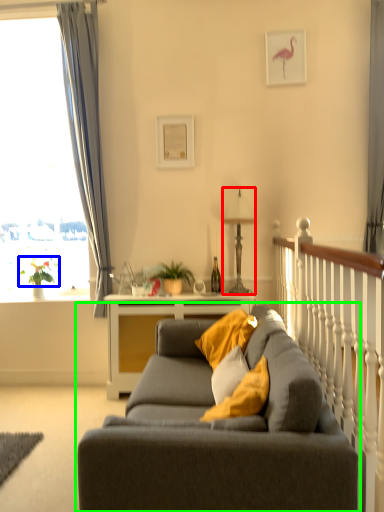
Question: Estimate the real-world distances between objects in this image. Which object is closer to lamp (highlighted by a red box), plant (highlighted by a blue box) or studio couch (highlighted by a green box)?

Choices:
 (A) plant
 (B) studio couch

Answer: (A)